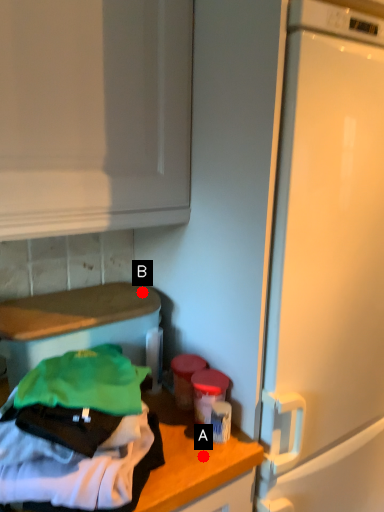
Question: Two points are circled on the image, labeled by A and B beside each circle. Which point is farther to the camera?

Choices:
 (A) A is further
 (B) B is further

Answer: (B)